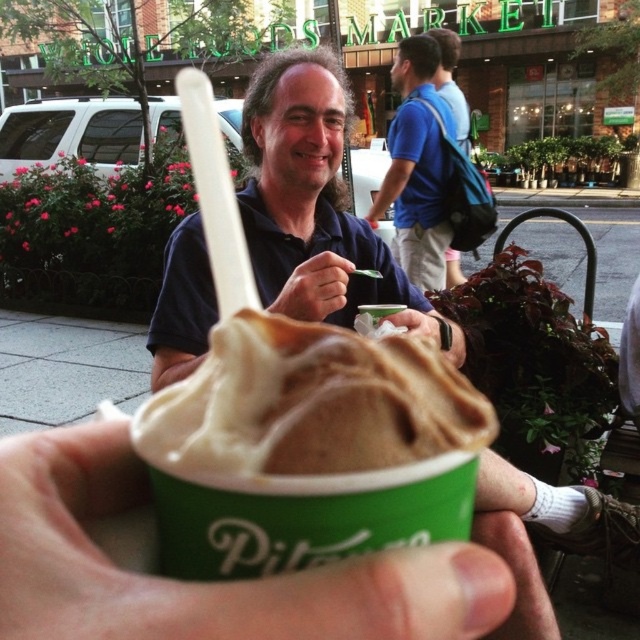
Is white matte cup at lower center in front of matte black hand at center?

Yes, it is in front of matte black hand at center.

Is white matte cup at lower center to the right of matte black hand at center from the viewer's perspective?

Incorrect, white matte cup at lower center is not on the right side of matte black hand at center.

Which is behind, point (113, 595) or point (291, 280)?

Point (291, 280)

Where is `white matte cup at lower center`? The image size is (640, 640). white matte cup at lower center is located at coordinates (211, 582).

Is whipped cream at center further to the viewer compared to blue cotton shirt at upper center?

No.

Can you confirm if whipped cream at center is shorter than blue cotton shirt at upper center?

Indeed, whipped cream at center has a lesser height compared to blue cotton shirt at upper center.

Is point (170, 388) positioned after point (428, 99)?

No, (170, 388) is closer to viewer.

Find the location of a particular element. This screenshot has width=640, height=640. whipped cream at center is located at coordinates (310, 403).

From the picture: Can you confirm if white matte cup at lower center is positioned to the left of blue cotton shirt at upper center?

Correct, you'll find white matte cup at lower center to the left of blue cotton shirt at upper center.

Which is more to the right, white matte cup at lower center or blue cotton shirt at upper center?

From the viewer's perspective, blue cotton shirt at upper center appears more on the right side.

Identify the location of white matte cup at lower center. [211, 582].

Where is `white matte cup at lower center`? white matte cup at lower center is located at coordinates (211, 582).